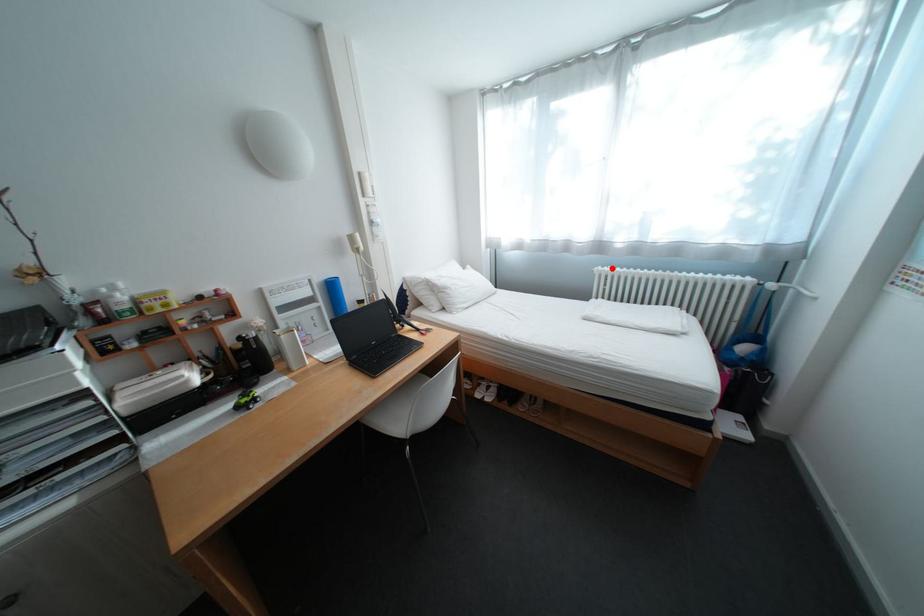
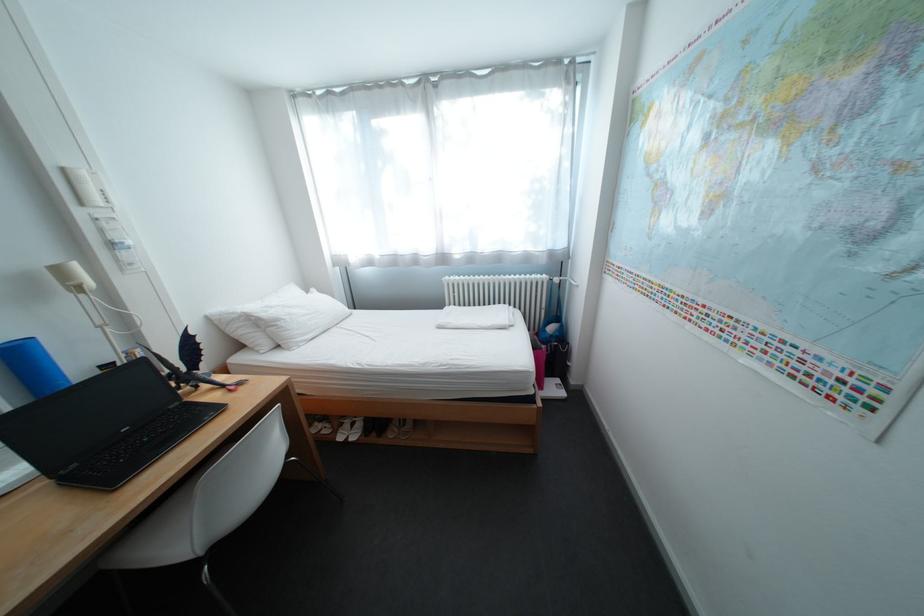
The point at the highlighted location is marked in the first image. Where is the corresponding point in the second image?

(459, 278)